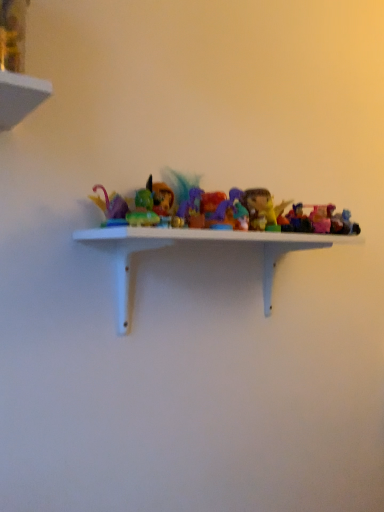
Question: Considering the positions of translucent plastic toy at center, which appears as the fourth toy when viewed from the left, and white matte shelf at center in the image, is translucent plastic toy at center, which appears as the fourth toy when viewed from the left, wider or thinner than white matte shelf at center?

Choices:
 (A) wide
 (B) thin

Answer: (B)

Question: Looking at the image, does translucent plastic toy at center, which appears as the fourth toy when viewed from the left, seem bigger or smaller compared to white matte shelf at center?

Choices:
 (A) big
 (B) small

Answer: (B)

Question: Which object is positioned closest to the matte green toy at center, which is the 1th toy from left to right?

Choices:
 (A) translucent purple figurine at center, which is counted as the second toy, starting from the left
 (B) translucent plastic toy at center, which appears as the 2th toy when viewed from the right
 (C) white matte shelf at center
 (D) translucent plastic toy at center, marked as the 3th toy in a right-to-left arrangement
 (E) translucent plastic figurine at center, the 4th toy viewed from the right

Answer: (A)

Question: Which object is positioned closest to the translucent plastic toy at center, which ranks as the 5th toy in left-to-right order?

Choices:
 (A) translucent purple figurine at center, placed as the fifth toy when sorted from right to left
 (B) translucent plastic toy at center, marked as the 3th toy in a right-to-left arrangement
 (C) white matte shelf at center
 (D) matte green toy at center, positioned as the 6th toy in right-to-left order
 (E) pink plastic toy at right, which appears as the sixth toy when viewed from the left

Answer: (E)